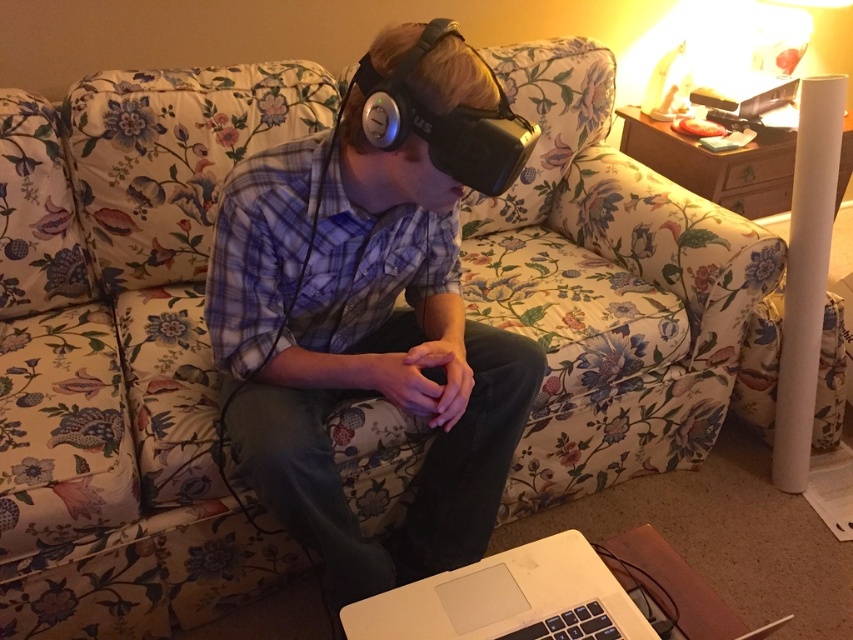
You are a delivery person who needs to place a new laptop on the desk in front of the person wearing the matte black vr headset at center and the white matte laptop at lower center. Where should you place the new laptop to avoid blocking the current setup?

The new laptop should be placed to the side of the white matte laptop at lower center since the matte black vr headset at center is above it and placing it directly in front would block the headset.

Looking at this image, you are a photographer trying to capture a clear shot of the white matte laptop at lower center. The matte black vr headset at center is blocking your view. Can you move the vr headset to the right to get a better angle? Why or why not?

The matte black vr headset at center is to the left of the white matte laptop at lower center. Moving it to the right would place it directly in front of the laptop, potentially blocking it further. Alternatively, moving it to the left might allow a clearer view.

You are a delivery person who needs to place a new VR headset and a laptop in a box. The box can only accommodate items with a combined length of 12 inches. Given the current distance between the matte black vr headset at center and the white matte laptop at lower center in the image, can you fit both items into the box?

The distance between the matte black vr headset at center and the white matte laptop at lower center is 14.05 inches, which exceeds the box capacity of 12 inches. Therefore, the items cannot be placed together in the box.